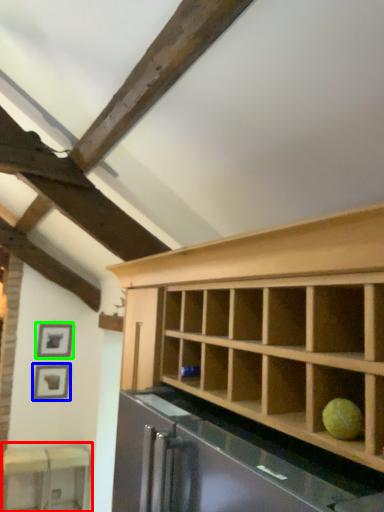
Question: Which object is the closest to the table (highlighted by a red box)? Choose among these: picture frame (highlighted by a blue box) or picture frame (highlighted by a green box).

Choices:
 (A) picture frame
 (B) picture frame

Answer: (A)